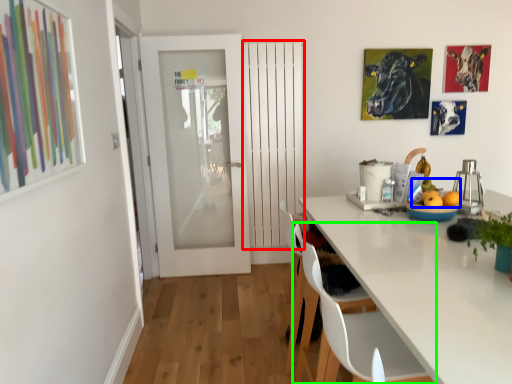
Question: Which object is the farthest from door (highlighted by a red box)? Choose among these: fruit (highlighted by a blue box) or chair (highlighted by a green box).

Choices:
 (A) fruit
 (B) chair

Answer: (B)